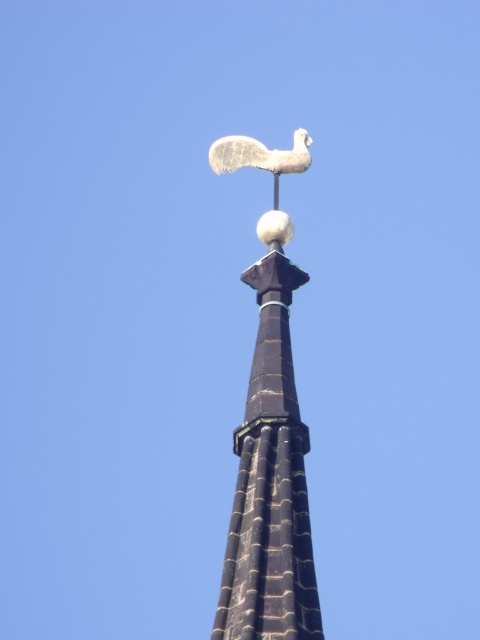
You are standing at the base of the black stone spire at upper center, which is part of a historic cathedral. You want to take a photo of the spire with your smartphone. The camera app shows that the distance to the spire is 63.67 meters. Is this distance accurate based on your current position?

The black stone spire at upper center is 63.67 meters from camera, so yes, the distance displayed on the camera app is accurate if you are standing at the base of the spire.

From the picture: You are standing at the base of the steeple looking upward. There are two points marked on the steeple. The first point is at coordinates point [282,460] and the second is at point [304,141]. Which point do you see closer to you when looking directly at the steeple?

Point [282,460] is in front of point [304,141], so you would see it closer to you when looking directly at the steeple.

You are an architect examining the steeple and notice the black stone spire at upper center and the white stone bird at upper center. From your viewpoint, which object is positioned to the left?

The white stone bird at upper center is positioned to the left of the black stone spire at upper center.